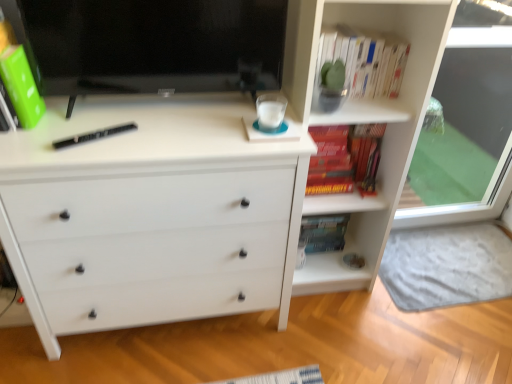
Find the location of `vacant space behind black hardback book at center`. vacant space behind black hardback book at center is located at coordinates (112, 117).